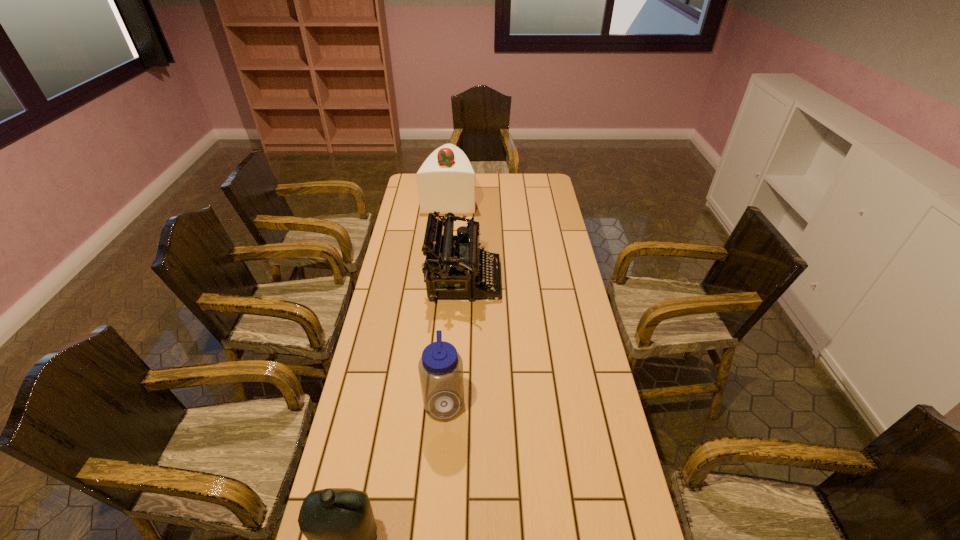
Where is `the tallest object`? The image size is (960, 540). the tallest object is located at coordinates (446, 180).

In order to click on cake in this screenshot , I will do `click(446, 180)`.

Locate an element on the screen. the third nearest object is located at coordinates (461, 263).

At what (x,y) coordinates should I click in order to perform the action: click on the second nearest object. Please return your answer as a coordinate pair (x, y). This screenshot has height=540, width=960. Looking at the image, I should click on (440, 367).

Find the location of `free space located 0.280m on the right of the cake`. free space located 0.280m on the right of the cake is located at coordinates (532, 197).

At what (x,y) coordinates should I click in order to perform the action: click on vacant space located 0.060m on the keyboard of the third nearest object. Please return your answer as a coordinate pair (x, y). Looking at the image, I should click on (516, 280).

You are a GUI agent. You are given a task and a screenshot of the screen. Output one action in this format:
    pyautogui.click(x=<x>, y=<y>)
    Task: Click on the vacant space located with a carrying loop on the side of the third farthest object
    This screenshot has width=960, height=540.
    Given the screenshot: What is the action you would take?
    pyautogui.click(x=564, y=401)

Locate an element on the screen. object located in the far edge section of the desktop is located at coordinates (446, 180).

I want to click on object present at the left edge, so pos(446,180).

Locate an element on the screen. object present at the far left corner is located at coordinates (446, 180).